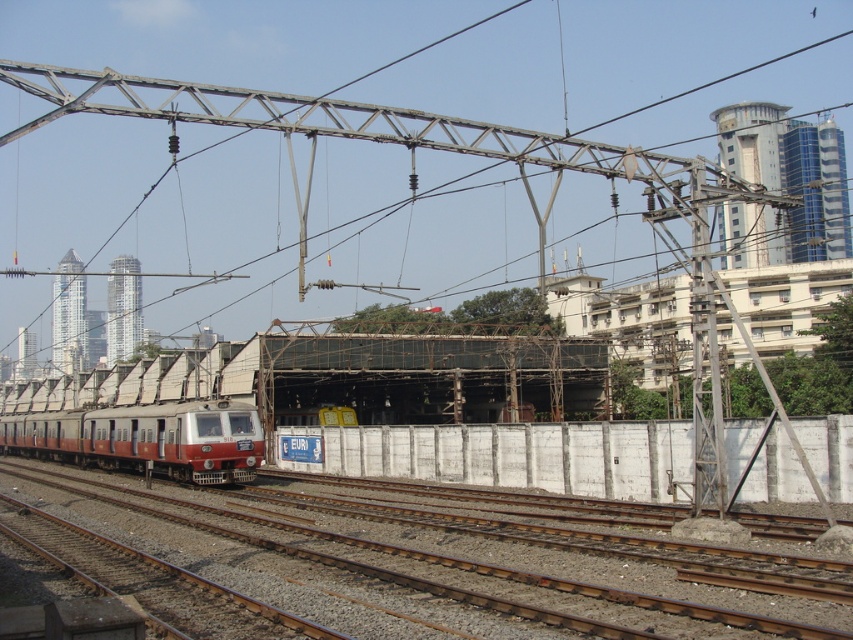
Does brown gravel train track at center have a greater height compared to red matte train at lower left?

No, brown gravel train track at center is not taller than red matte train at lower left.

Can you confirm if brown gravel train track at center is bigger than red matte train at lower left?

No, brown gravel train track at center is not bigger than red matte train at lower left.

Where is `brown gravel train track at center`? brown gravel train track at center is located at coordinates pos(403,564).